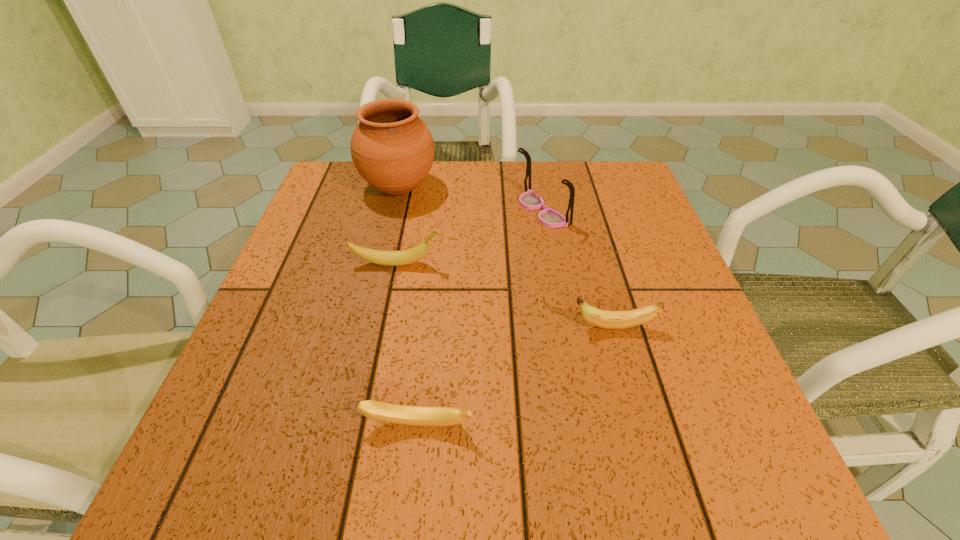
Identify which banana is the closest to the second nearest banana. Please provide its 2D coordinates. Your answer should be formatted as a tuple, i.e. [(x, y)], where the tuple contains the x and y coordinates of a point satisfying the conditions above.

[(400, 414)]

Choose which banana is the second nearest neighbor to the spectacles. Please provide its 2D coordinates. Your answer should be formatted as a tuple, i.e. [(x, y)], where the tuple contains the x and y coordinates of a point satisfying the conditions above.

[(604, 319)]

Identify the location of vacant area in the image that satisfies the following two spatial constraints: 1. at the stem of the fourth farthest object; 2. at the stem of the shortest object. This screenshot has height=540, width=960. (640, 424).

Find the location of a particular element. This screenshot has width=960, height=540. vacant region that satisfies the following two spatial constraints: 1. at the stem of the fourth farthest object; 2. at the stem of the nearest object is located at coordinates tap(640, 424).